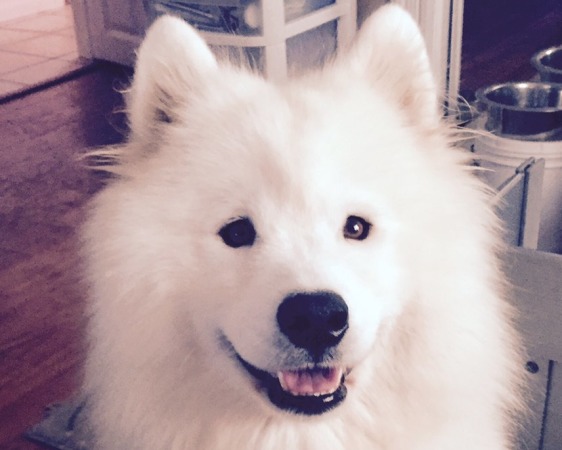
Locate an element on the screen. The width and height of the screenshot is (562, 450). wall is located at coordinates (11, 4).